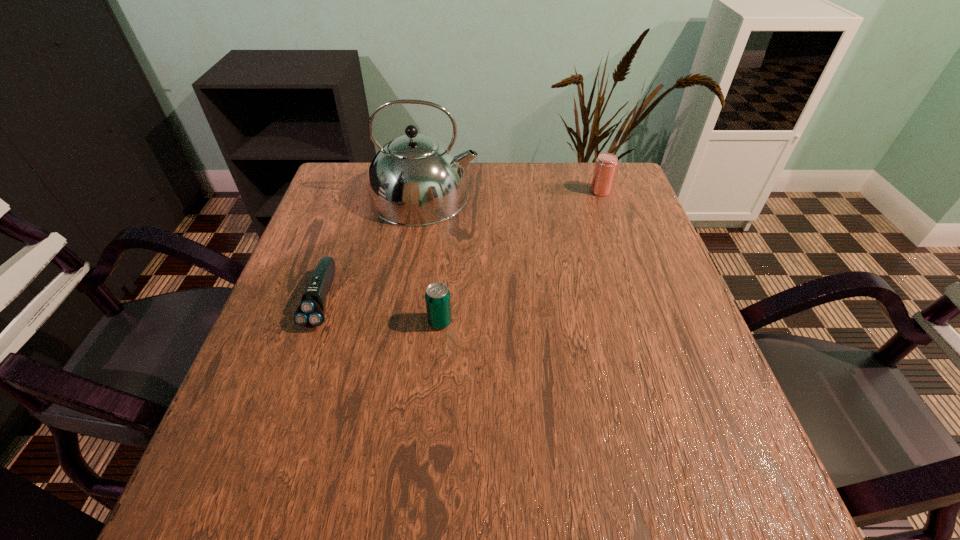
This screenshot has width=960, height=540. In the image, there is a desktop. What are the coordinates of `free space at the right edge` in the screenshot? It's located at click(602, 253).

The width and height of the screenshot is (960, 540). I want to click on free space at the far left corner of the desktop, so click(x=346, y=186).

I want to click on free space between the shortest object and the kettle, so click(373, 248).

Image resolution: width=960 pixels, height=540 pixels. I want to click on free space that is in between the kettle and the left beer can, so click(432, 259).

This screenshot has width=960, height=540. I want to click on free spot between the farther beer can and the tallest object, so click(x=513, y=194).

Where is `free point between the leftmost object and the left beer can`? This screenshot has height=540, width=960. free point between the leftmost object and the left beer can is located at coordinates (381, 311).

Find the location of a particular element. The image size is (960, 540). empty space between the tallest object and the right beer can is located at coordinates (513, 194).

The image size is (960, 540). Find the location of `empty space that is in between the kettle and the shortest object`. empty space that is in between the kettle and the shortest object is located at coordinates (373, 248).

This screenshot has height=540, width=960. What are the coordinates of `blank region between the shortest object and the left beer can` in the screenshot? It's located at (381, 311).

Image resolution: width=960 pixels, height=540 pixels. Find the location of `blank region between the right beer can and the nearer beer can`. blank region between the right beer can and the nearer beer can is located at coordinates (520, 256).